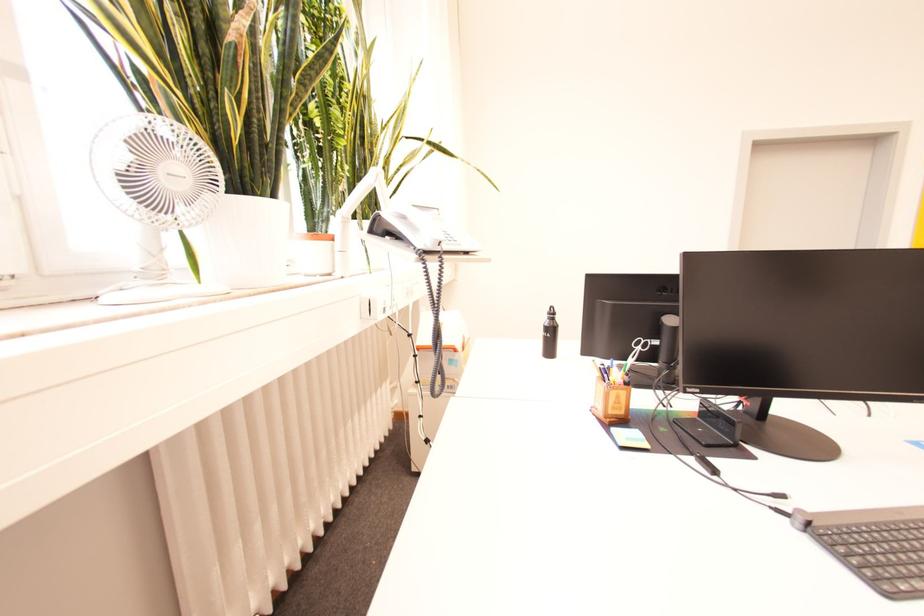
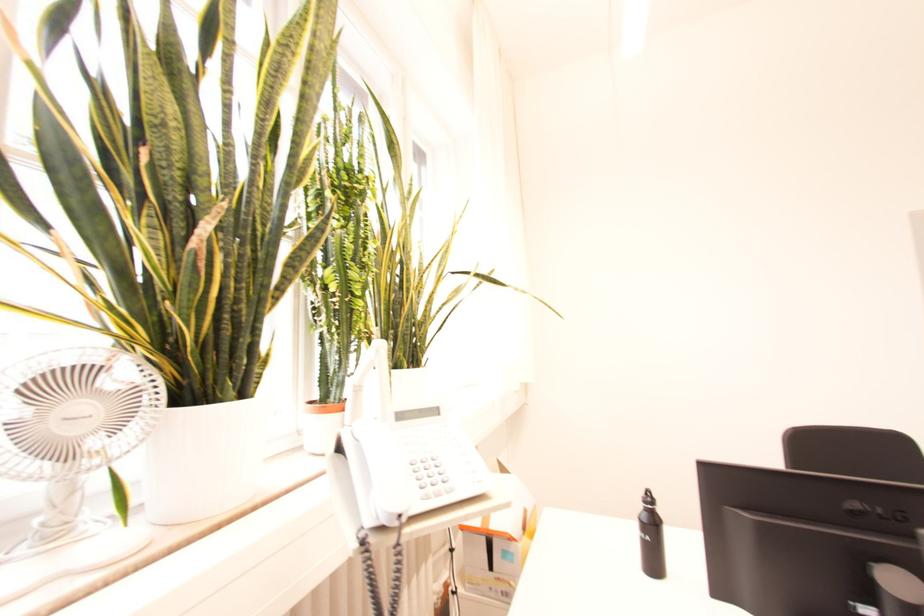
Where in the second image is the point corresponding to pixel 268 197 from the first image?

(227, 402)